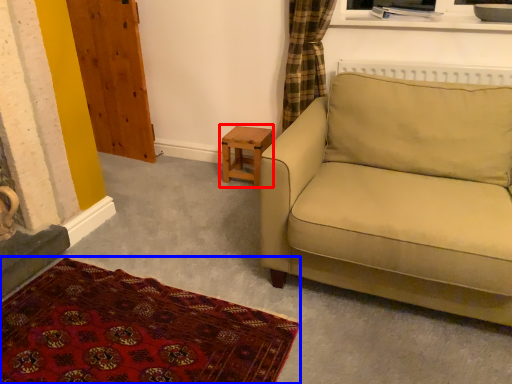
Question: Which point is closer to the camera, table (highlighted by a red box) or plain (highlighted by a blue box)?

Choices:
 (A) table
 (B) plain

Answer: (B)